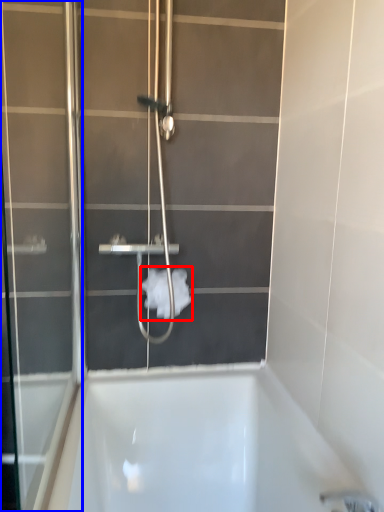
Question: Which point is closer to the camera, toilet paper (highlighted by a red box) or screen door (highlighted by a blue box)?

Choices:
 (A) toilet paper
 (B) screen door

Answer: (B)